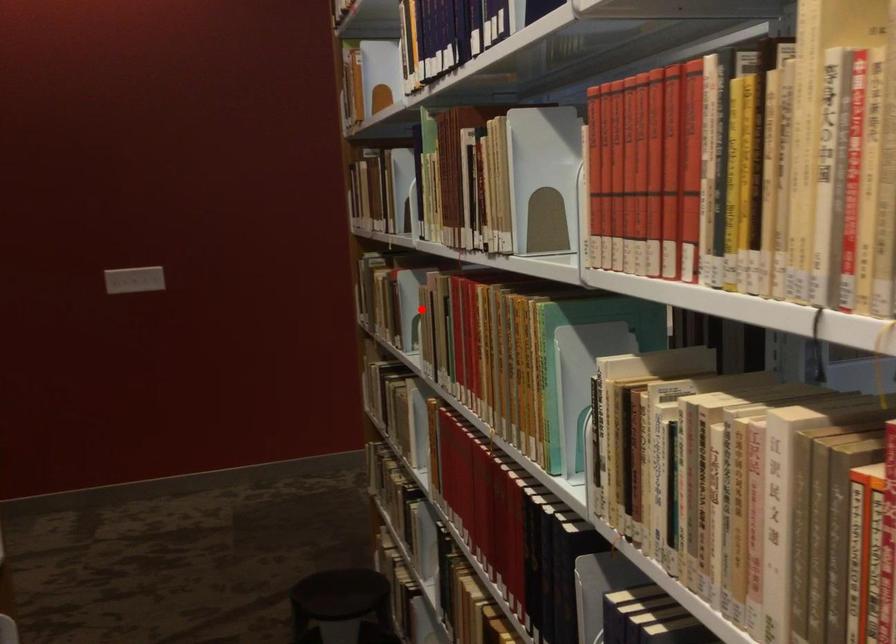
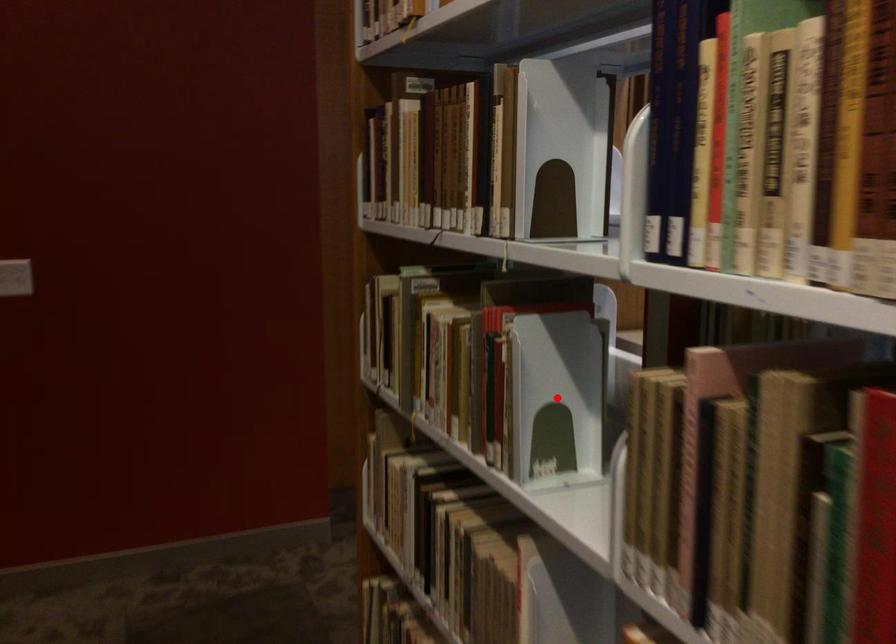
I am providing you with two images of the same scene from different viewpoints. A red point is marked on the first image and another point is marked on the second image. Is the marked point in image1 the same physical position as the marked point in image2?

Yes